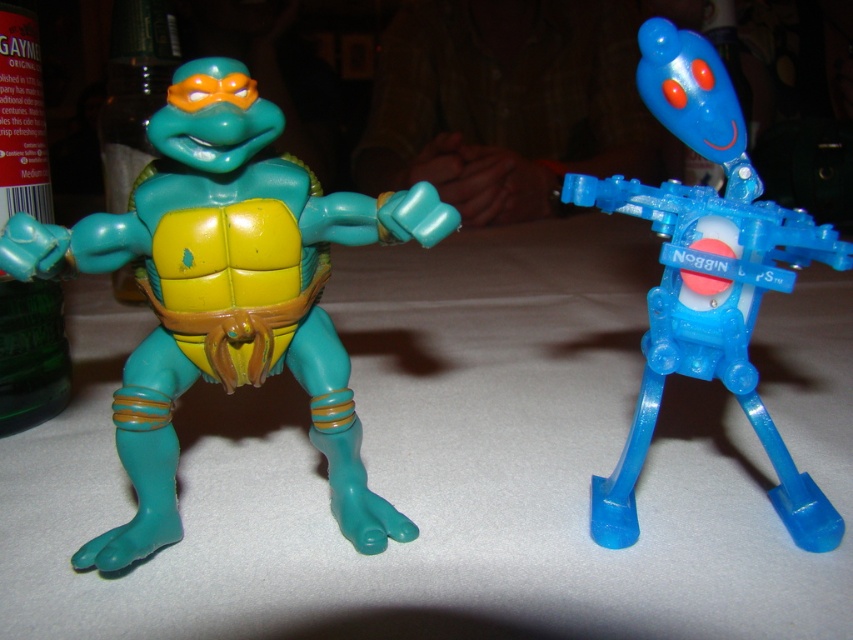
Question: Which of the following is the closest to the observer?

Choices:
 (A) (16, 381)
 (B) (202, 576)

Answer: (B)

Question: Which object is positioned closest to the white matte table at center?

Choices:
 (A) green matte bottle at left
 (B) green glass bottle at left

Answer: (B)

Question: Observing the image, what is the correct spatial positioning of matte plastic turtle at left in reference to green glass bottle at left?

Choices:
 (A) left
 (B) right

Answer: (B)

Question: Observing the image, what is the correct spatial positioning of matte plastic turtle at left in reference to green glass bottle at left?

Choices:
 (A) left
 (B) right

Answer: (B)

Question: Which point is closer to the camera taking this photo?

Choices:
 (A) (24, 337)
 (B) (318, 244)
 (C) (177, 35)

Answer: (B)

Question: Considering the relative positions of translucent blue plastic robot at right and green glass bottle at left in the image provided, where is translucent blue plastic robot at right located with respect to green glass bottle at left?

Choices:
 (A) below
 (B) above

Answer: (A)